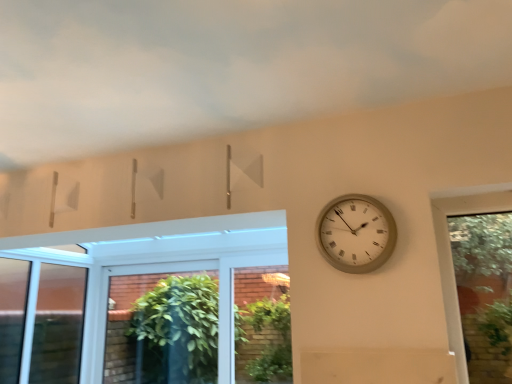
Question: Considering the positions of cloudy sky at upper center and beige textured clock at right in the image, is cloudy sky at upper center wider or thinner than beige textured clock at right?

Choices:
 (A) thin
 (B) wide

Answer: (B)

Question: In the image, is cloudy sky at upper center positioned in front of or behind beige textured clock at right?

Choices:
 (A) behind
 (B) front

Answer: (B)

Question: Considering the real-world distances, which object is closest to the green leafy plant at lower center?

Choices:
 (A) beige textured clock at right
 (B) cloudy sky at upper center

Answer: (A)

Question: Which is nearer to the beige textured clock at right?

Choices:
 (A) green leafy plant at lower center
 (B) cloudy sky at upper center

Answer: (B)